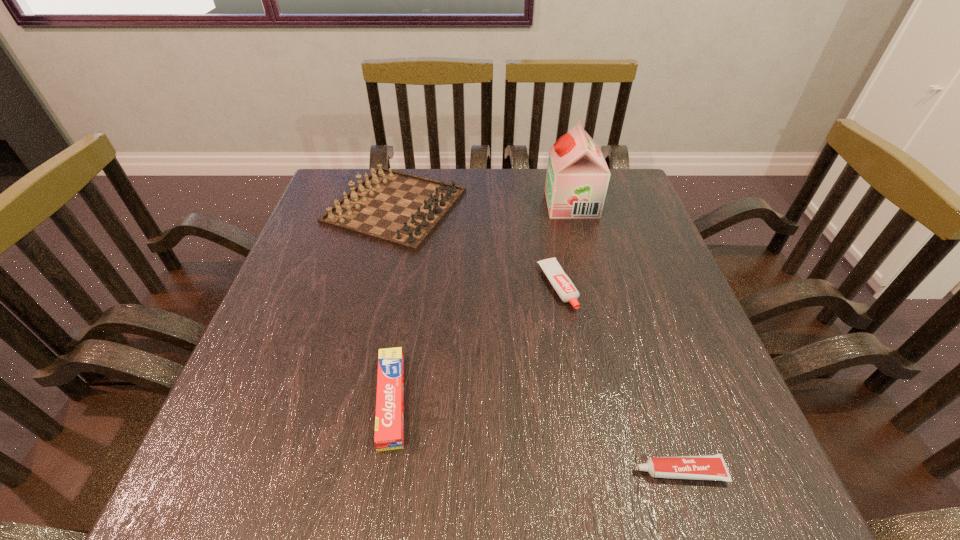
Locate an element on the screen. The height and width of the screenshot is (540, 960). soya milk located at the right edge is located at coordinates (577, 178).

Where is `toothpaste that is at the right edge`? toothpaste that is at the right edge is located at coordinates (698, 467).

Find the location of a particular element. This screenshot has height=540, width=960. object that is at the far left corner is located at coordinates (390, 206).

Find the location of a particular element. Image resolution: width=960 pixels, height=540 pixels. object at the far right corner is located at coordinates (577, 178).

Locate an element on the screen. The height and width of the screenshot is (540, 960). object located in the near right corner section of the desktop is located at coordinates (698, 467).

You are a GUI agent. You are given a task and a screenshot of the screen. Output one action in this format:
    pyautogui.click(x=<x>, y=<y>)
    Task: Click on the vacant space at the far edge of the desktop
    This screenshot has height=540, width=960.
    Given the screenshot: What is the action you would take?
    pyautogui.click(x=475, y=201)

Find the location of `vacant space at the near edge`. vacant space at the near edge is located at coordinates (627, 455).

In the image, there is a desktop. Where is `vacant area at the left edge`? The image size is (960, 540). vacant area at the left edge is located at coordinates (342, 235).

Where is `free space at the right edge of the desktop`? The image size is (960, 540). free space at the right edge of the desktop is located at coordinates (661, 275).

What are the coordinates of `vacant area at the near left corner of the desktop` in the screenshot? It's located at (202, 455).